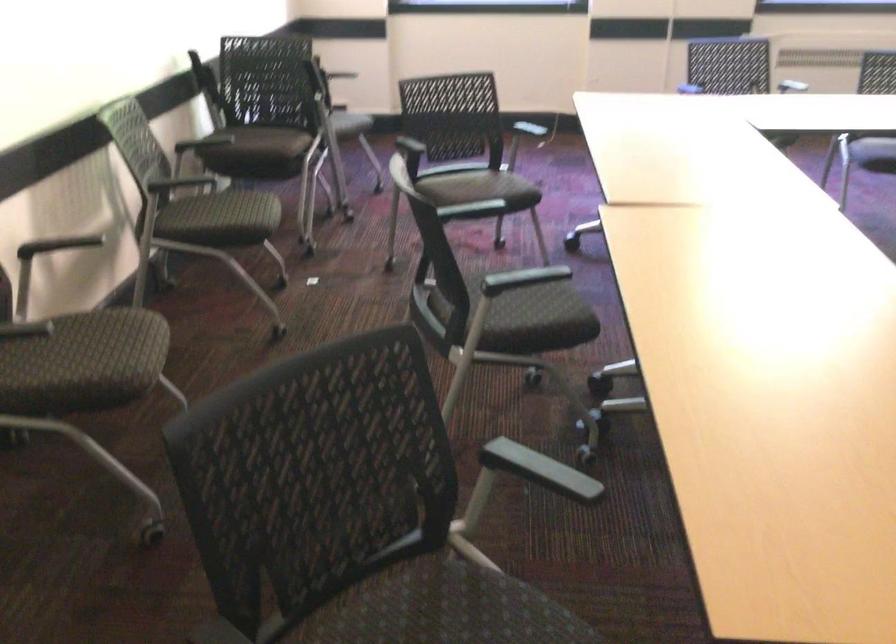
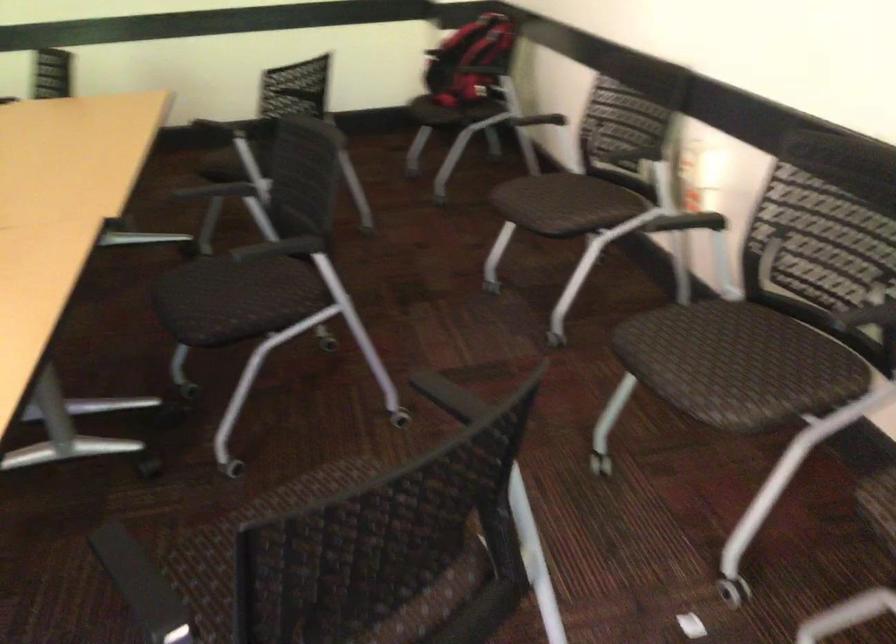
In the second image, find the point that corresponds to point 113,321 in the first image.

(581, 207)